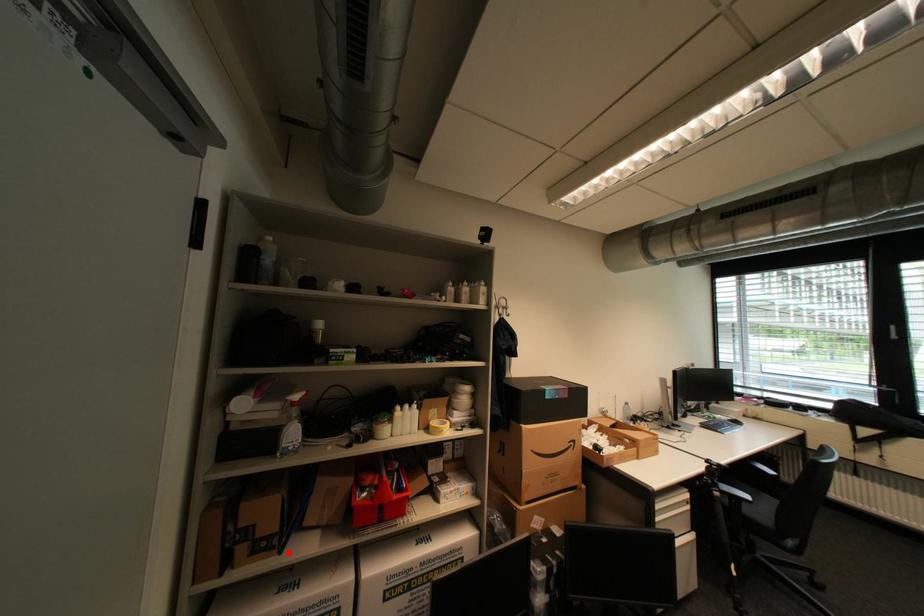
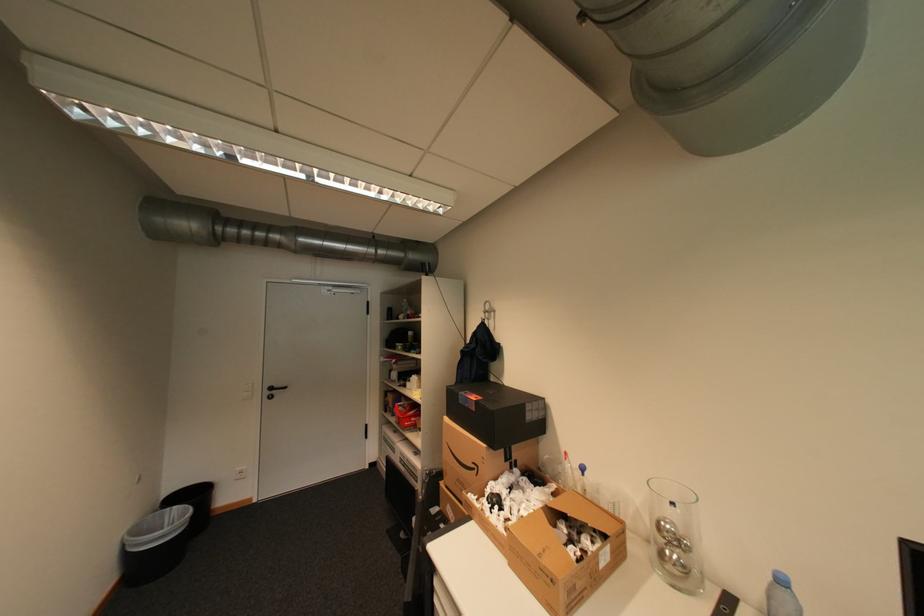
The point at the highlighted location is marked in the first image. Where is the corresponding point in the second image?

(400, 416)